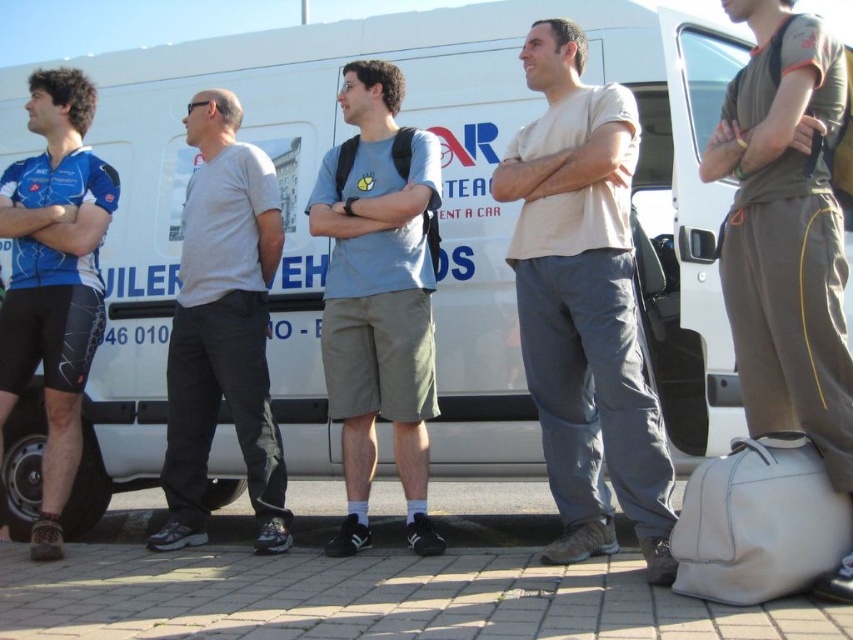
Is gray cotton t-shirt at center taller than blue jersey at left?

Incorrect, gray cotton t-shirt at center's height is not larger of blue jersey at left's.

Does gray cotton t-shirt at center have a smaller size compared to blue jersey at left?

Actually, gray cotton t-shirt at center might be larger than blue jersey at left.

Who is more forward, (241, 444) or (79, 88)?

Point (241, 444) is in front.

This screenshot has width=853, height=640. Identify the location of gray cotton t-shirt at center. (223, 328).

Which is above, light gray cotton t-shirt at center or gray cotton t-shirt at center?

light gray cotton t-shirt at center

Is point (438, 554) positioned in front of point (213, 308)?

Yes.

What do you see at coordinates (378, 298) in the screenshot?
I see `light gray cotton t-shirt at center` at bounding box center [378, 298].

Where is `light gray cotton t-shirt at center`? This screenshot has height=640, width=853. light gray cotton t-shirt at center is located at coordinates (378, 298).

Does light beige cotton t-shirt at center have a greater width compared to gray cotton t-shirt at center?

Incorrect, light beige cotton t-shirt at center's width does not surpass gray cotton t-shirt at center's.

Between point (556, 160) and point (177, 404), which one is positioned in front?

Positioned in front is point (556, 160).

This screenshot has height=640, width=853. Describe the element at coordinates (584, 305) in the screenshot. I see `light beige cotton t-shirt at center` at that location.

Locate an element on the screen. This screenshot has height=640, width=853. light beige cotton t-shirt at center is located at coordinates (584, 305).